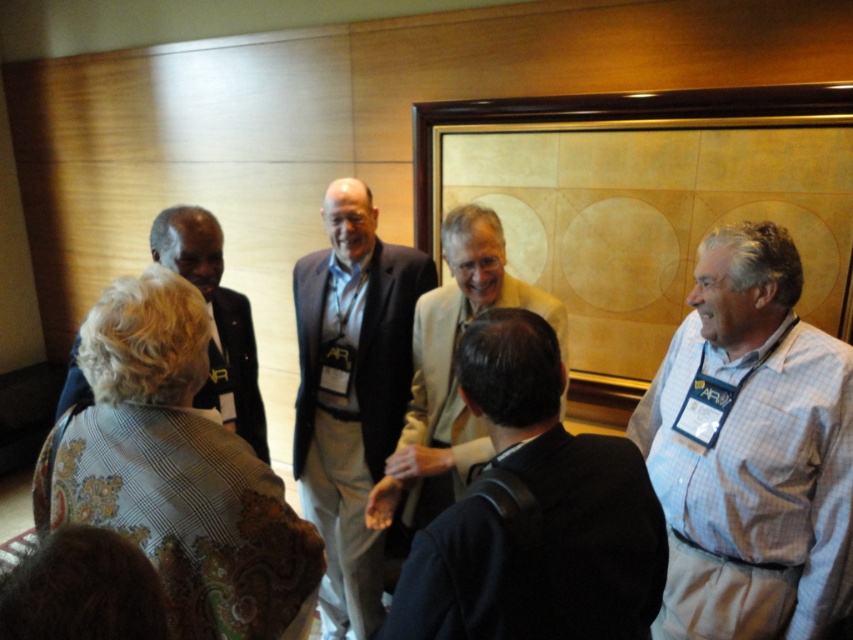
You are standing in the middle of the scene and want to move towards the nearest point between point (804, 476) and point (364, 227). Which point should you walk towards?

Point (804, 476) is closer to the camera than point (364, 227), so you should walk towards point (804, 476).

Based on the scene description, which object is taller between the dark blue suit at center and the light beige suit at center?

The dark blue suit at center is taller than the light beige suit at center.